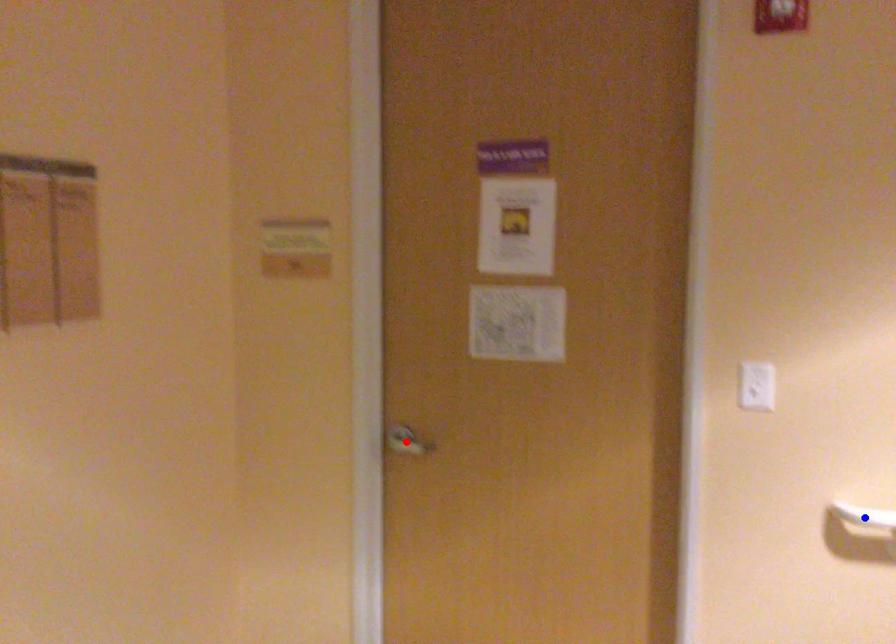
Question: Which of the two points in the image is closer to the camera?

Choices:
 (A) Blue point is closer.
 (B) Red point is closer.

Answer: (A)